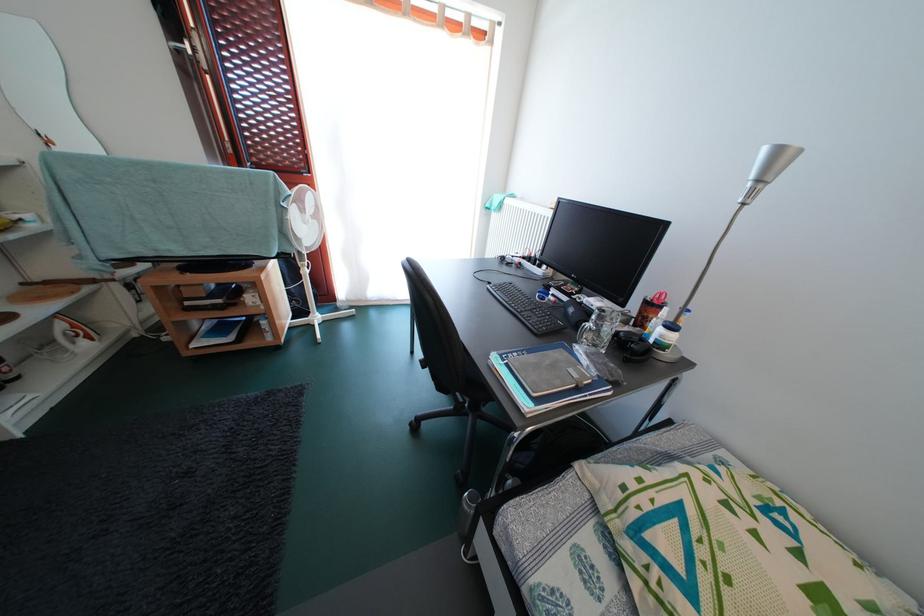
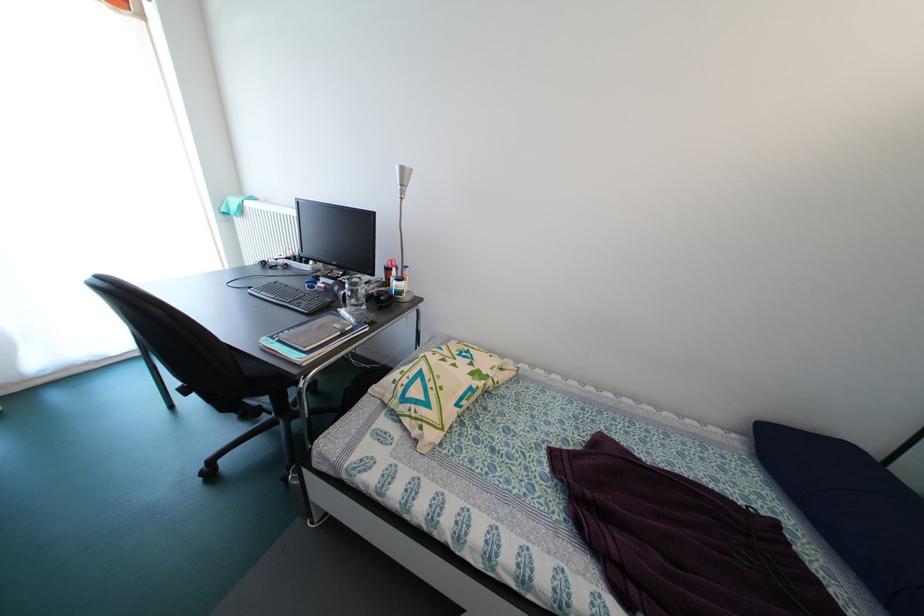
Locate, in the second image, the point that corresponds to [798,517] in the first image.

(479, 355)